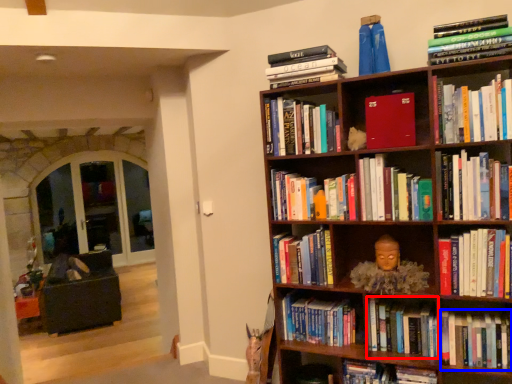
Question: Which object is further to the camera taking this photo, book (highlighted by a red box) or book (highlighted by a blue box)?

Choices:
 (A) book
 (B) book

Answer: (A)